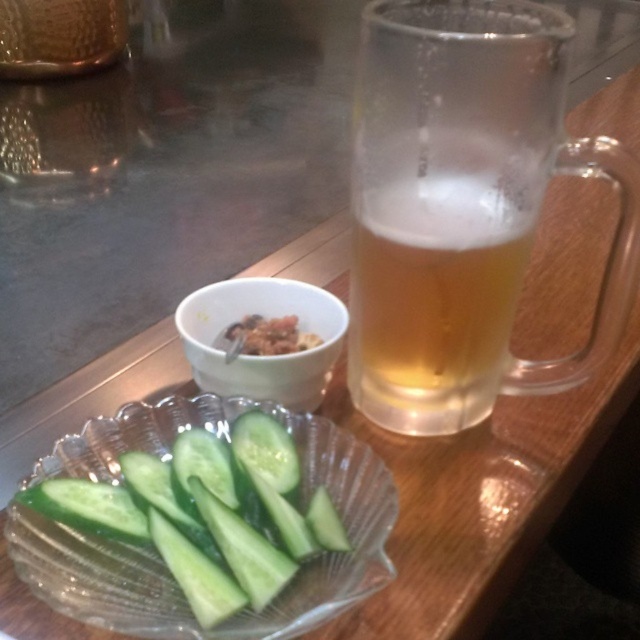
You are a waiter in a restaurant. You need to place a 15 cm long cucumber spear on the table without moving any existing items. The table has the frothy amber glass at upper right and the green smooth cucumber at lower left. Can you fit the cucumber spear between them?

The distance between the frothy amber glass at upper right and the green smooth cucumber at lower left is 14.41 centimeters. Since the cucumber spear is 15 cm long, it cannot fit between them without moving existing items.

You are a server checking table settings. The frothy amber glass at upper right and the savory crumbly snack at center are on the table. Which object is wider?

The frothy amber glass at upper right is wider than the savory crumbly snack at center.

You are a waiter who needs to place a 5 inch long utensil between the frothy amber glass at upper right and the savory crumbly snack at center. Can you fit it there?

The distance between the frothy amber glass at upper right and the savory crumbly snack at center is 4.97 inches, so the 5 inch utensil cannot fit between them.